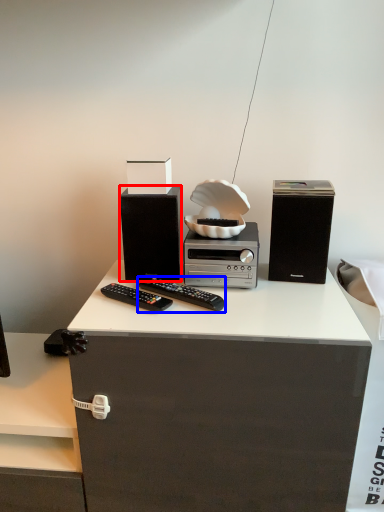
Question: Which of the following is the closest to the observer, speaker (highlighted by a red box) or remote control (highlighted by a blue box)?

Choices:
 (A) speaker
 (B) remote control

Answer: (B)